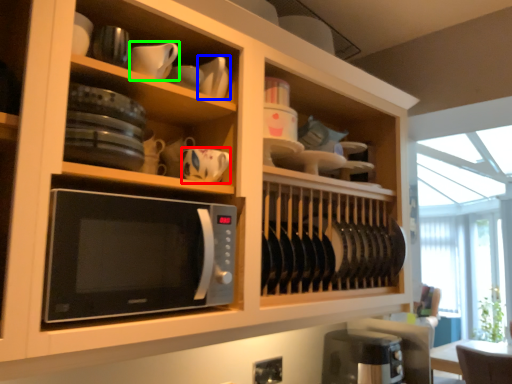
Question: Which object is positioned closest to tableware (highlighted by a red box)? Select from tableware (highlighted by a blue box) and tableware (highlighted by a green box).

Choices:
 (A) tableware
 (B) tableware

Answer: (A)